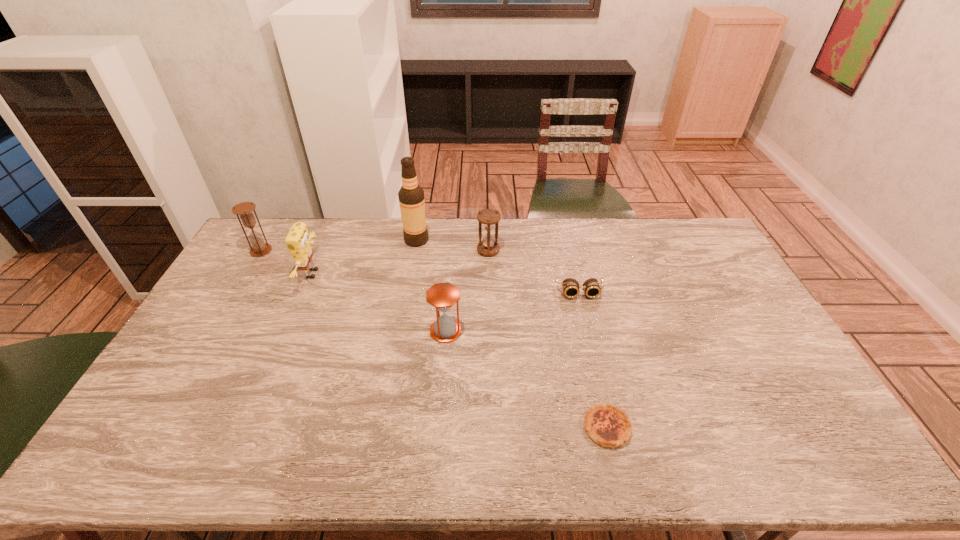
Locate an element on the screen. Image resolution: width=960 pixels, height=540 pixels. object situated at the left edge is located at coordinates (259, 248).

The width and height of the screenshot is (960, 540). What are the coordinates of `object that is positioned at the far left corner` in the screenshot? It's located at (259, 248).

The width and height of the screenshot is (960, 540). Find the location of `free space at the far edge of the desktop`. free space at the far edge of the desktop is located at coordinates (473, 227).

This screenshot has width=960, height=540. In order to click on vacant space at the near edge of the desktop in this screenshot , I will do `click(499, 458)`.

In the image, there is a desktop. Identify the location of free space at the left edge. The width and height of the screenshot is (960, 540). (166, 380).

Identify the location of vacant space at the right edge of the desktop. (761, 381).

In the image, there is a desktop. Where is `vacant space at the far right corner`? The height and width of the screenshot is (540, 960). vacant space at the far right corner is located at coordinates [687, 235].

Image resolution: width=960 pixels, height=540 pixels. I want to click on vacant area between the fifth object from right to left and the fifth object from left to right, so click(452, 245).

I want to click on free spot between the leftmost object and the rightmost hourglass, so click(374, 251).

Where is `unoccupied area between the third object from left to right and the second object from left to right`? unoccupied area between the third object from left to right and the second object from left to right is located at coordinates (365, 257).